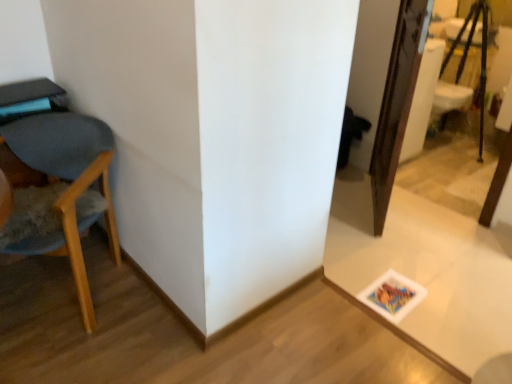
Question: In the image, is white glossy table at lower right on the left side or the right side of wooden tripod at upper right?

Choices:
 (A) right
 (B) left

Answer: (B)

Question: From a real-world perspective, is white glossy table at lower right positioned above or below wooden tripod at upper right?

Choices:
 (A) above
 (B) below

Answer: (B)

Question: Which of these objects is positioned farthest from the wooden chair at left?

Choices:
 (A) wooden tripod at upper right
 (B) white glossy table at lower right

Answer: (A)

Question: Which object is positioned closest to the wooden tripod at upper right?

Choices:
 (A) white glossy table at lower right
 (B) wooden chair at left

Answer: (A)